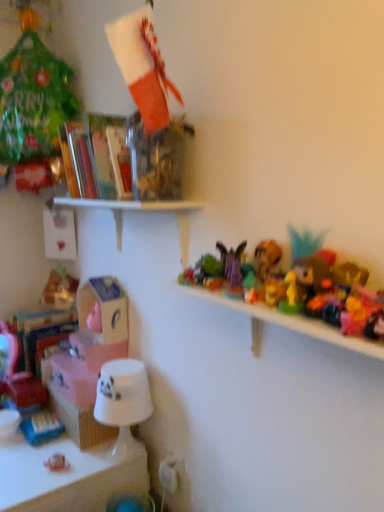
Question: Looking at their shapes, would you say shiny plastic toy at center right, the 5th toy in the back-to-front sequence, is wider or thinner than translucent plastic books at upper left, marked as the 3th shelf in a bottom-to-top arrangement?

Choices:
 (A) wide
 (B) thin

Answer: (B)

Question: From a real-world perspective, is shiny plastic toy at center right, marked as the 4th toy in a left-to-right arrangement, positioned above or below translucent plastic books at upper left, which is the first shelf in top-to-bottom order?

Choices:
 (A) above
 (B) below

Answer: (B)

Question: Which object is the closest to the white matte shelf at upper center, placed as the 2th shelf when sorted from top to bottom?

Choices:
 (A) matte pink plush at left, arranged as the first toy when ordered from the bottom
 (B) purple fabric butterfly at upper center, which appears as the 2th toy when viewed from the top
 (C) pink matte box at lower left, the 1th box in the bottom-to-top sequence
 (D) shiny plastic toy at center right, marked as the fourth toy in a top-to-bottom arrangement
 (E) translucent plastic books at upper left, which is the first shelf in top-to-bottom order

Answer: (E)

Question: Estimate the real-world distances between objects in this image. Which object is farther from the white cardboard box at center-left, the first box when ordered from top to bottom?

Choices:
 (A) matte pink plush at left, placed as the 5th toy when sorted from front to back
 (B) white glossy lampshade at lower left
 (C) green matte toy at center, which is the third toy in bottom-to-top order
 (D) white glass table at lower left
 (E) white glossy cup at lower left, the first shelf when ordered from bottom to top

Answer: (C)